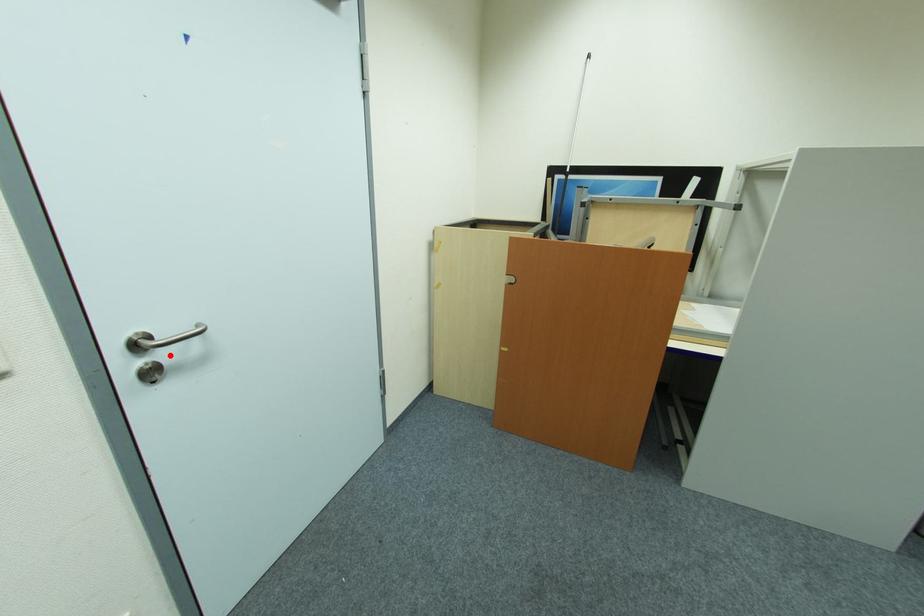
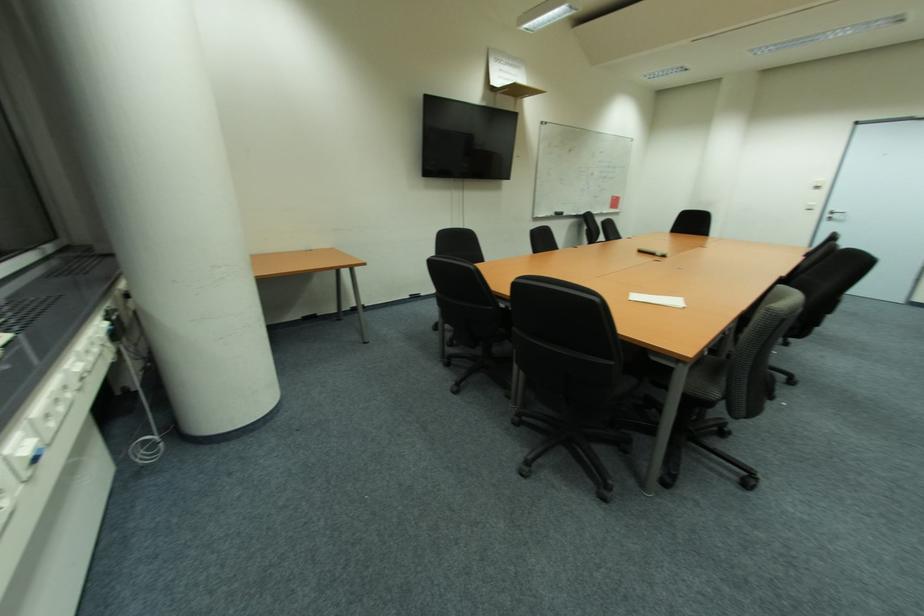
In the second image, find the point that corresponds to the highlighted location in the first image.

(842, 217)